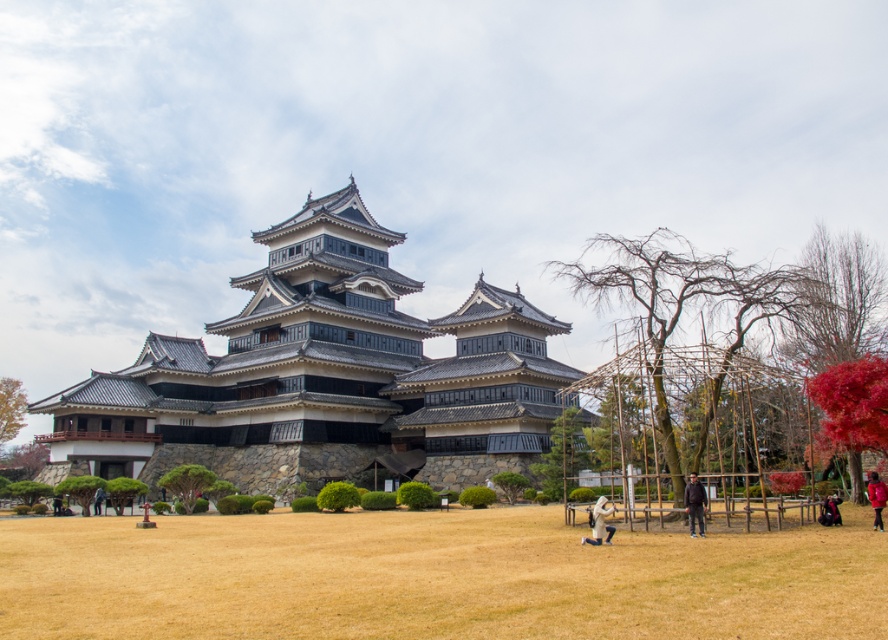
You are standing at the center of the grassy area in front of the traditional Japanese castle. There is a point marked at coordinates (682,317). What is the significance of this point in relation to the castle?

The point (682,317) represents the location of the bare wood structure at right, indicating its position relative to the castle in the scene.

You are standing at the entrance of the black stone castle at center. If you walk straight ahead, will you step onto the grassy area or the bushes?

Since the black stone castle at center is positioned at point (x=323, y=374), walking straight ahead from the entrance would lead you towards the grassy area in the foreground, as the bushes are scattered across it but the primary surface is grass.